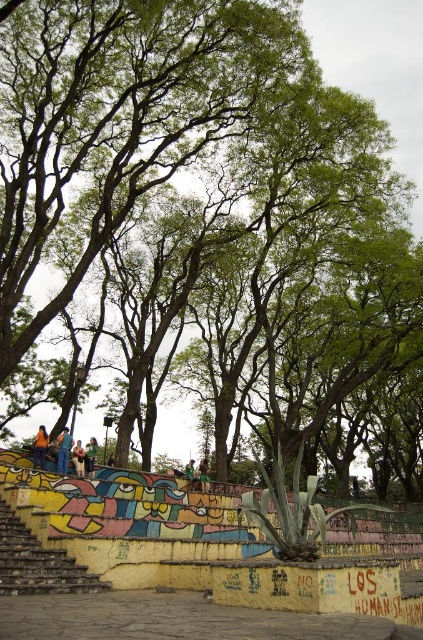
Question: Does blue jeans at lower left have a lesser width compared to orange fabric person at lower left?

Choices:
 (A) no
 (B) yes

Answer: (B)

Question: Observing the image, what is the correct spatial positioning of orange fabric person at lower left in reference to light brown leather jacket at lower left?

Choices:
 (A) below
 (B) above

Answer: (B)

Question: Which point is closer to the camera?

Choices:
 (A) (57, 472)
 (B) (87, 448)
 (C) (76, 452)

Answer: (A)

Question: Does light brown leather jacket at lower left have a lesser width compared to green fabric shirt at center?

Choices:
 (A) yes
 (B) no

Answer: (B)

Question: Which object is farther from the camera taking this photo?

Choices:
 (A) orange fabric person at lower left
 (B) blue jeans at lower left
 (C) green fabric shirt at lower left

Answer: (C)

Question: Which point appears closest to the camera in this image?

Choices:
 (A) (202, 476)
 (B) (90, 454)
 (C) (84, 474)

Answer: (C)